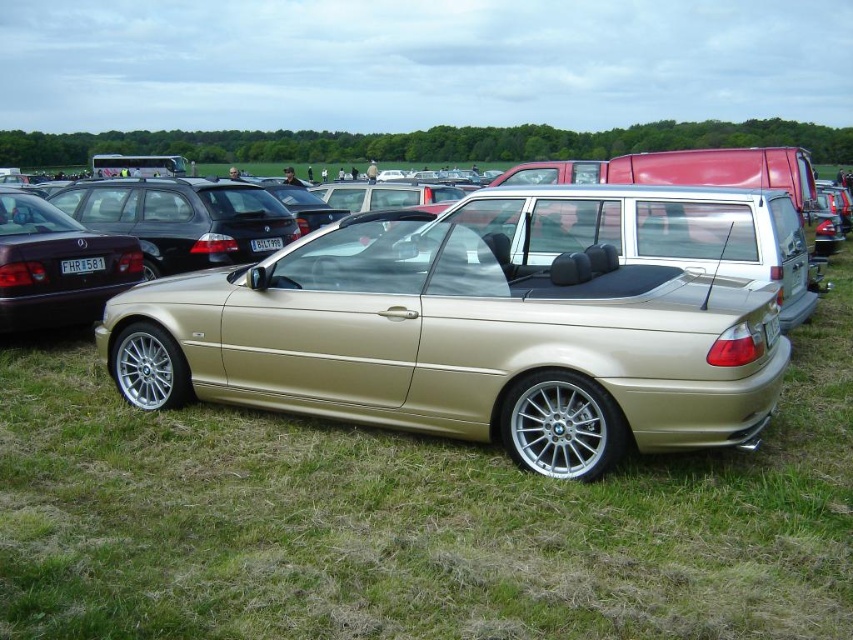
You are standing at the point with coordinates point (88, 262) and want to walk towards the gold BMW convertible parked on the grassy field. Which direction should you move relative to the other point point (531, 429)?

You should move towards the direction of point (531, 429) because it is in front of point (88, 262), so moving towards it would lead you toward the gold BMW convertible.

You are a photographer trying to capture the silver metallic rim at lower center and the black plastic license plate at center in the same frame. Which object should you zoom in on to ensure both are clearly visible without cropping either?

You should zoom in on the silver metallic rim at lower center because its width is greater than the black plastic license plate at center, allowing both to fit within the frame without cropping.

You are a photographer trying to capture the gold metallic minivan at center and the silver metallic rim at lower center in a single frame. Based on their positions, which object should you focus on first to ensure both are in the shot?

The gold metallic minivan at center is located above the silver metallic rim at lower center, so focusing on the gold metallic minivan at center first will allow you to frame the shot to include both objects.